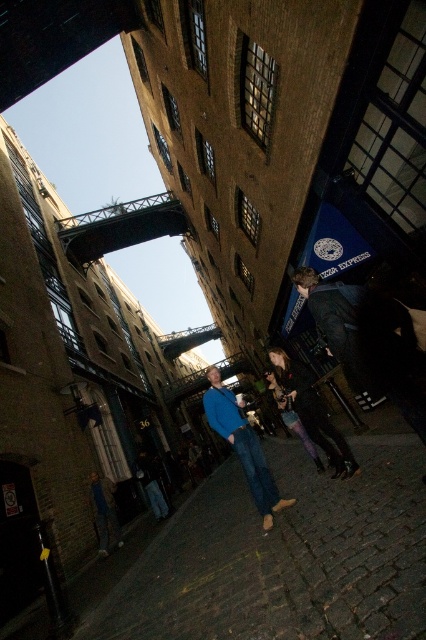
You are standing on the cobblestone street in the scene and want to take a photo of both the dark blue jeans at lower right and the denim pants at center. Since you can only focus on one object at a time, which one should you focus on first to ensure the other is also in focus?

You should focus on the dark blue jeans at lower right first because it is closer to you than the denim pants at center. By focusing on the closer object, the farther one will still be within the depth of field, ensuring both are in focus.

You are a fashion designer observing the urban scene at night. You notice a person wearing a matte blue sweater at center and denim pants at center. Which clothing item has a greater horizontal width when viewed from your perspective?

The matte blue sweater at center has a greater horizontal width than the denim pants at center.

You are standing in the urban scene and want to move from the point at coordinates point (324,314) to the point at coordinates point (250,435). Which direction should you move to get closer to the camera?

To move closer to the camera, you should move towards point (324,314) because it is closer to the camera than point (250,435).